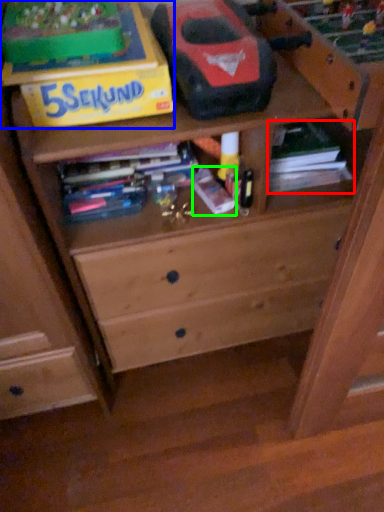
Question: Which object is the farthest from book (highlighted by a red box)? Choose among these: cardboard box (highlighted by a blue box) or book (highlighted by a green box).

Choices:
 (A) cardboard box
 (B) book

Answer: (A)